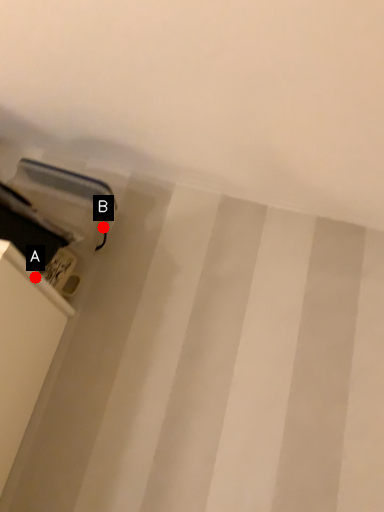
Question: Two points are circled on the image, labeled by A and B beside each circle. Which point appears farthest from the camera in this image?

Choices:
 (A) A is further
 (B) B is further

Answer: (B)